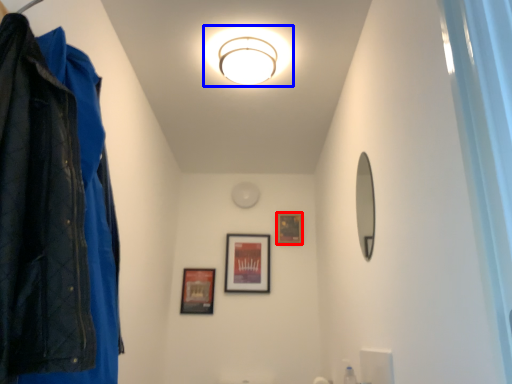
Question: Which object appears farthest to the camera in this image, picture frame (highlighted by a red box) or light fixture (highlighted by a blue box)?

Choices:
 (A) picture frame
 (B) light fixture

Answer: (A)